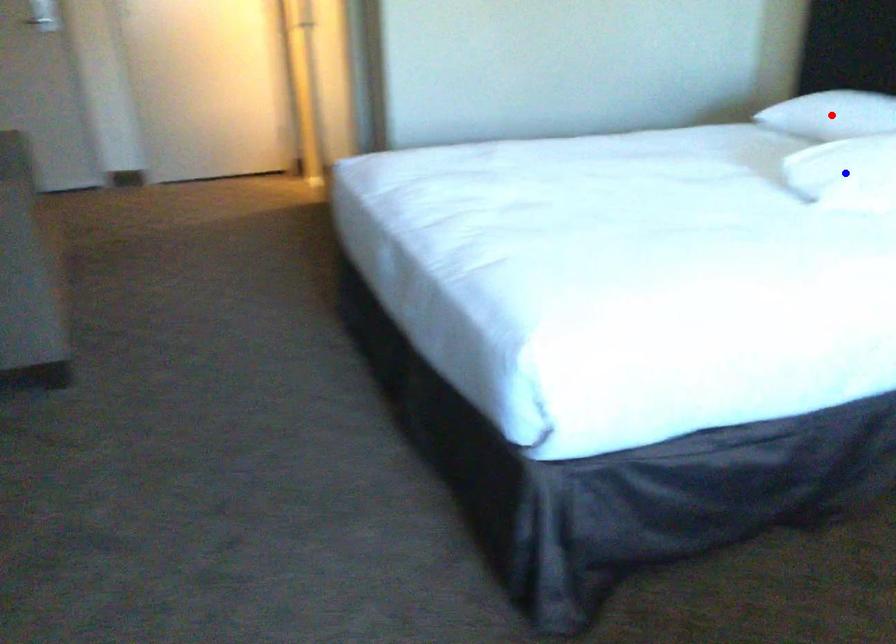
Question: Two points are marked on the image. Which point is closer to the camera?

Choices:
 (A) Blue point is closer.
 (B) Red point is closer.

Answer: (A)